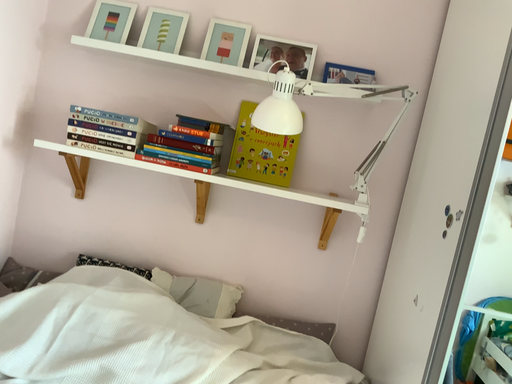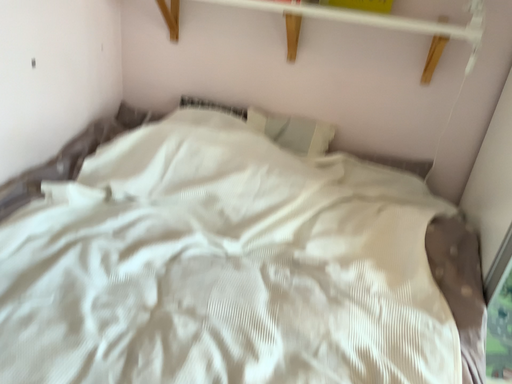
Question: How did the camera likely rotate when shooting the video?

Choices:
 (A) rotated downward
 (B) rotated upward

Answer: (A)